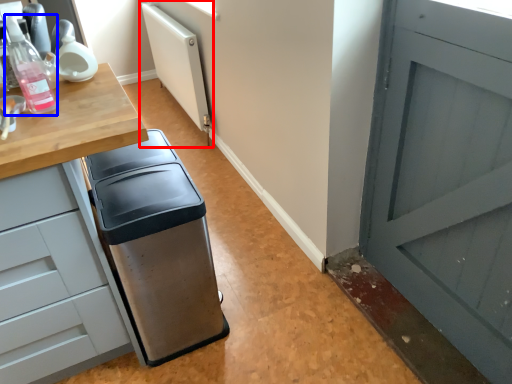
Question: Which object is closer to the camera taking this photo, radiator (highlighted by a red box) or bottle (highlighted by a blue box)?

Choices:
 (A) radiator
 (B) bottle

Answer: (B)